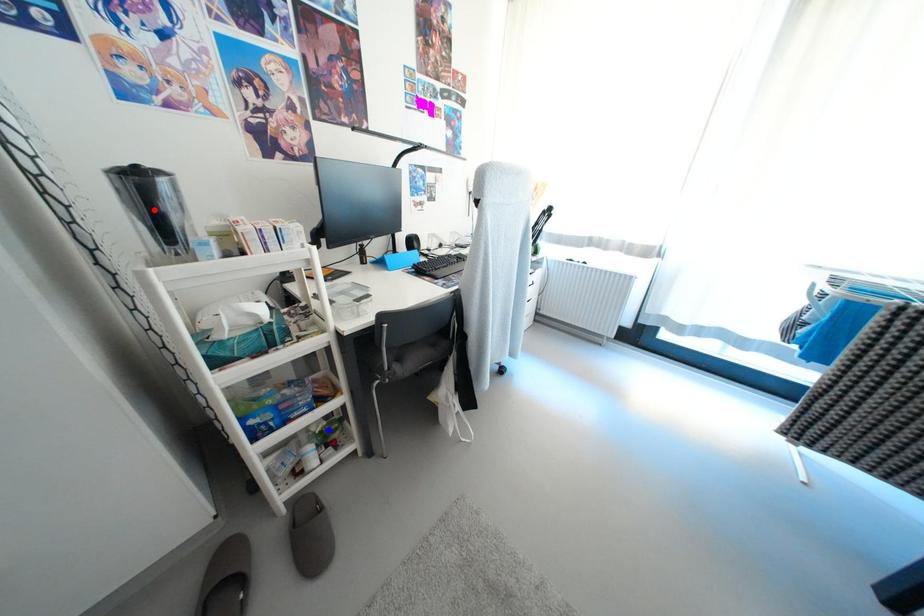
Question: In the image, two points are highlighted. Which point is nearer to the camera? Reply with the corresponding letter.

Choices:
 (A) blue point
 (B) red point

Answer: (B)